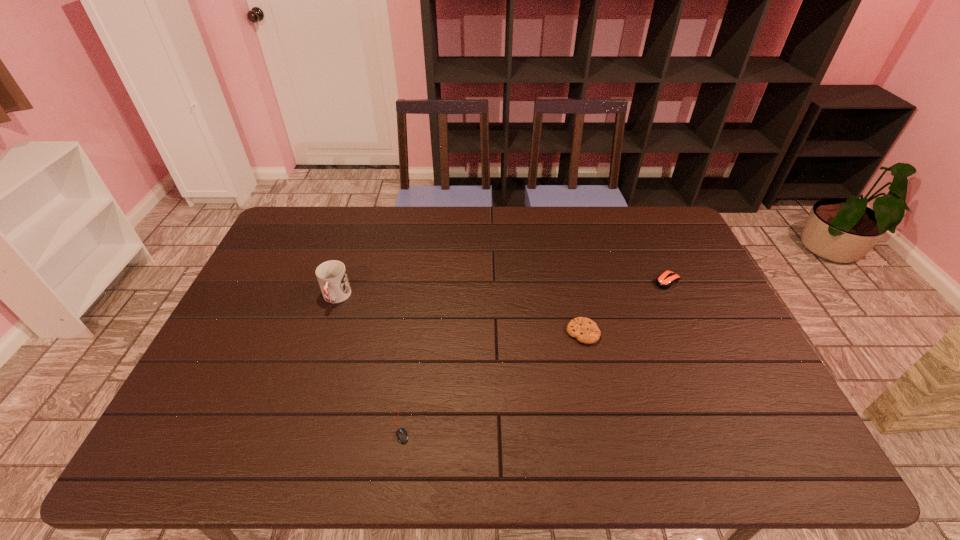
Select which object appears as the second closest to the nearer mouse. Please provide its 2D coordinates. Your answer should be formatted as a tuple, i.e. [(x, y)], where the tuple contains the x and y coordinates of a point satisfying the conditions above.

[(586, 331)]

Find the location of `object that stands as the second closest to the third farthest object`. object that stands as the second closest to the third farthest object is located at coordinates pyautogui.click(x=402, y=437).

You are a GUI agent. You are given a task and a screenshot of the screen. Output one action in this format:
    pyautogui.click(x=<x>, y=<y>)
    Task: Click on the vacant area in the image that satisfies the following two spatial constraints: 1. on the handle side of the cup; 2. on the left side of the second object from left to right
    The width and height of the screenshot is (960, 540).
    Given the screenshot: What is the action you would take?
    click(293, 427)

Where is `vacant point that satisfies the following two spatial constraints: 1. on the handle side of the cup; 2. on the left side of the third object from right to left`? The height and width of the screenshot is (540, 960). vacant point that satisfies the following two spatial constraints: 1. on the handle side of the cup; 2. on the left side of the third object from right to left is located at coordinates (293, 427).

The height and width of the screenshot is (540, 960). In order to click on free location that satisfies the following two spatial constraints: 1. on the back side of the second object from right to left; 2. on the right side of the nearer mouse in this screenshot , I will do `click(415, 333)`.

Identify the location of vacant space that satisfies the following two spatial constraints: 1. on the handle side of the cup; 2. on the left side of the cookie. The width and height of the screenshot is (960, 540). (324, 333).

Where is `vacant position in the image that satisfies the following two spatial constraints: 1. on the handle side of the left mouse; 2. on the left side of the tallest object`? The image size is (960, 540). vacant position in the image that satisfies the following two spatial constraints: 1. on the handle side of the left mouse; 2. on the left side of the tallest object is located at coordinates (293, 427).